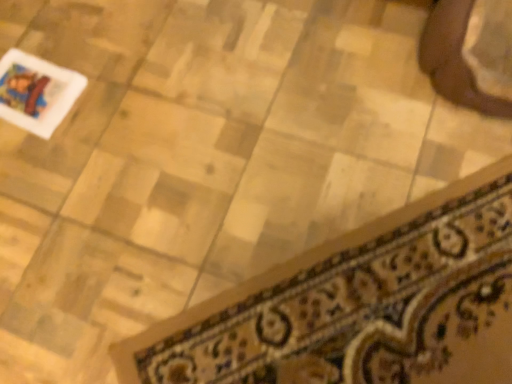
Consider the image. What is the approximate height of patterned fabric doormat at lower right?

1.46 inches.

What do you see at coordinates (360, 305) in the screenshot? I see `patterned fabric doormat at lower right` at bounding box center [360, 305].

Where is `patterned fabric doormat at lower right`? The image size is (512, 384). patterned fabric doormat at lower right is located at coordinates (360, 305).

In order to face brown leather shoe at upper right, should I rotate leftwards or rightwards?

It's best to rotate right around 27.380 degrees.

Measure the distance between brown leather shoe at upper right and camera.

brown leather shoe at upper right and camera are 3.34 feet apart from each other.

Locate an element on the screen. The height and width of the screenshot is (384, 512). brown leather shoe at upper right is located at coordinates (454, 59).

What do you see at coordinates (454, 59) in the screenshot?
I see `brown leather shoe at upper right` at bounding box center [454, 59].

Measure the distance between point (418, 57) and camera.

A distance of 1.14 meters exists between point (418, 57) and camera.

Locate an element on the screen. Image resolution: width=512 pixels, height=384 pixels. patterned fabric doormat at lower right is located at coordinates (360, 305).

Which object is positioned more to the left, patterned fabric doormat at lower right or brown leather shoe at upper right?

patterned fabric doormat at lower right.

Is patterned fabric doormat at lower right in front of or behind brown leather shoe at upper right in the image?

patterned fabric doormat at lower right is positioned closer to the viewer than brown leather shoe at upper right.

Is point (404, 239) farther from camera compared to point (440, 74)?

That is False.

From the image's perspective, is patterned fabric doormat at lower right located beneath brown leather shoe at upper right?

Indeed, from the image's perspective, patterned fabric doormat at lower right is shown beneath brown leather shoe at upper right.

From a real-world perspective, is patterned fabric doormat at lower right physically above brown leather shoe at upper right?

No, from a real-world perspective, patterned fabric doormat at lower right is not on top of brown leather shoe at upper right.

Considering the sizes of objects patterned fabric doormat at lower right and brown leather shoe at upper right in the image provided, who is wider, patterned fabric doormat at lower right or brown leather shoe at upper right?

patterned fabric doormat at lower right is wider.

Which of these two, patterned fabric doormat at lower right or brown leather shoe at upper right, stands shorter?

patterned fabric doormat at lower right.

Considering the relative sizes of patterned fabric doormat at lower right and brown leather shoe at upper right in the image provided, is patterned fabric doormat at lower right smaller than brown leather shoe at upper right?

Yes.

Is patterned fabric doormat at lower right spatially inside brown leather shoe at upper right, or outside of it?

patterned fabric doormat at lower right is located beyond the bounds of brown leather shoe at upper right.

Consider the image. Are patterned fabric doormat at lower right and brown leather shoe at upper right making contact?

No, patterned fabric doormat at lower right is not in contact with brown leather shoe at upper right.

Could you tell me if patterned fabric doormat at lower right is turned towards brown leather shoe at upper right?

No, patterned fabric doormat at lower right is not aimed at brown leather shoe at upper right.

How many degrees apart are the facing directions of patterned fabric doormat at lower right and brown leather shoe at upper right?

patterned fabric doormat at lower right and brown leather shoe at upper right are facing 45.8 degrees away from each other.

Locate an element on the screen. doormat located underneath the brown leather shoe at upper right (from a real-world perspective) is located at coordinates (360, 305).

Is brown leather shoe at upper right to the left or to the right of patterned fabric doormat at lower right in the image?

Clearly, brown leather shoe at upper right is on the right of patterned fabric doormat at lower right in the image.

Which object is closer to the camera, brown leather shoe at upper right or patterned fabric doormat at lower right?

patterned fabric doormat at lower right is closer to the camera.

Is point (432, 44) less distant than point (488, 184)?

No, it is not.

From the image's perspective, who appears lower, brown leather shoe at upper right or patterned fabric doormat at lower right?

patterned fabric doormat at lower right, from the image's perspective.

From a real-world perspective, is brown leather shoe at upper right below patterned fabric doormat at lower right?

No, from a real-world perspective, brown leather shoe at upper right is not beneath patterned fabric doormat at lower right.

Which of these two, brown leather shoe at upper right or patterned fabric doormat at lower right, is thinner?

brown leather shoe at upper right.

In terms of height, does brown leather shoe at upper right look taller or shorter compared to patterned fabric doormat at lower right?

Clearly, brown leather shoe at upper right is taller compared to patterned fabric doormat at lower right.

Can you confirm if brown leather shoe at upper right is smaller than patterned fabric doormat at lower right?

Incorrect, brown leather shoe at upper right is not smaller in size than patterned fabric doormat at lower right.

Is patterned fabric doormat at lower right located within brown leather shoe at upper right?

No, brown leather shoe at upper right does not contain patterned fabric doormat at lower right.

Can you see brown leather shoe at upper right touching patterned fabric doormat at lower right?

No, brown leather shoe at upper right is not with patterned fabric doormat at lower right.

Is brown leather shoe at upper right facing towards patterned fabric doormat at lower right?

Yes, brown leather shoe at upper right is aimed at patterned fabric doormat at lower right.

What's the angular difference between brown leather shoe at upper right and patterned fabric doormat at lower right's facing directions?

The angular difference between brown leather shoe at upper right and patterned fabric doormat at lower right is 45.8 degrees.

How distant is brown leather shoe at upper right from patterned fabric doormat at lower right?

brown leather shoe at upper right and patterned fabric doormat at lower right are 19.10 inches apart.

This screenshot has height=384, width=512. What are the coordinates of `footwear that appears on the right of patterned fabric doormat at lower right` in the screenshot? It's located at (454, 59).

The height and width of the screenshot is (384, 512). Identify the location of footwear behind the patterned fabric doormat at lower right. (454, 59).

The width and height of the screenshot is (512, 384). I want to click on doormat to the left of brown leather shoe at upper right, so click(x=360, y=305).